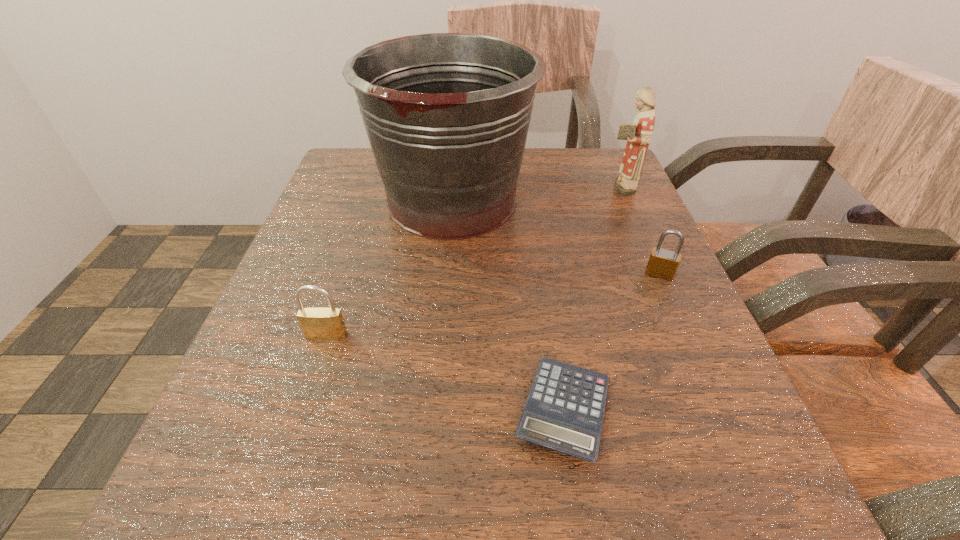
Find the location of a particular element. Image resolution: width=960 pixels, height=540 pixels. the tallest object is located at coordinates (447, 115).

I want to click on the second tallest object, so click(x=639, y=134).

Locate an element on the screen. Image resolution: width=960 pixels, height=540 pixels. the left padlock is located at coordinates (317, 323).

Locate an element on the screen. the nearer padlock is located at coordinates 317,323.

Where is `the third nearest object`? The height and width of the screenshot is (540, 960). the third nearest object is located at coordinates (662, 263).

Locate an element on the screen. The height and width of the screenshot is (540, 960). the farther padlock is located at coordinates (662, 263).

The width and height of the screenshot is (960, 540). In order to click on the nearest object in this screenshot , I will do `click(564, 411)`.

Where is `calculator`? calculator is located at coordinates (564, 411).

At what (x,y) coordinates should I click in order to perform the action: click on vacant space located 0.390m on the front of the tallest object. Please return your answer as a coordinate pair (x, y). The height and width of the screenshot is (540, 960). Looking at the image, I should click on (429, 472).

Find the location of a particular element. This screenshot has height=540, width=960. vacant space located 0.230m on the front-facing side of the fourth shortest object is located at coordinates (496, 187).